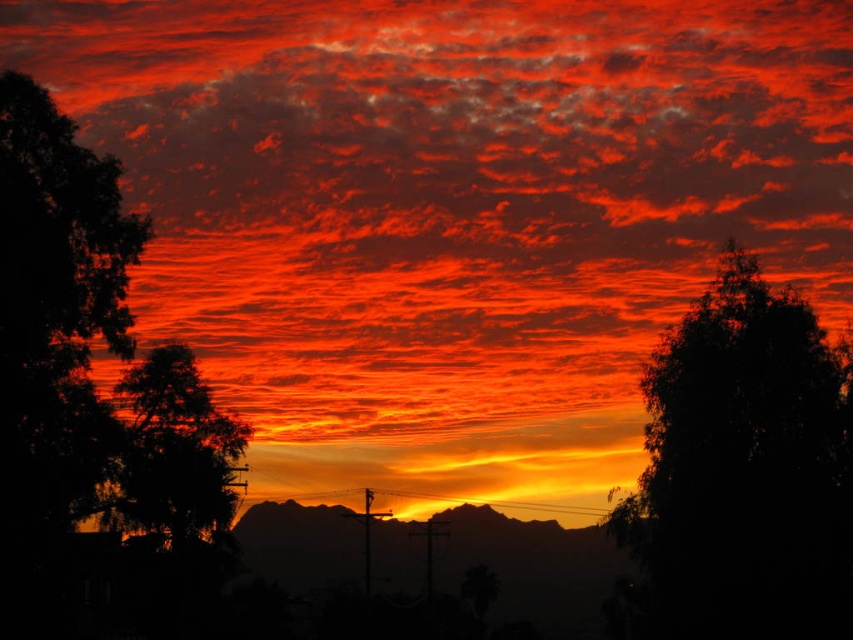
You are an astronomer analyzing the sunset scene. You notice a point at coordinates (744,470). What object is located at that point?

The silky dark green tree at upper right is located at point (744,470).

You are an artist trying to paint this sunset scene. You want to ensure that the silky dark green tree at upper right and the silhouette tree at left are positioned correctly according to their depth. Which tree should you paint first to create the illusion of depth?

You should paint the silhouette tree at left first because the silky dark green tree at upper right is in front of it, so it needs to be painted on top to show proper depth.

You are a photographer trying to capture the sunset. You want to position your camera so that the silky dark green tree at upper right is centered in the frame. What coordinate should you aim for?

You should aim for the coordinate point at (744,470) to center the silky dark green tree at upper right in your frame.